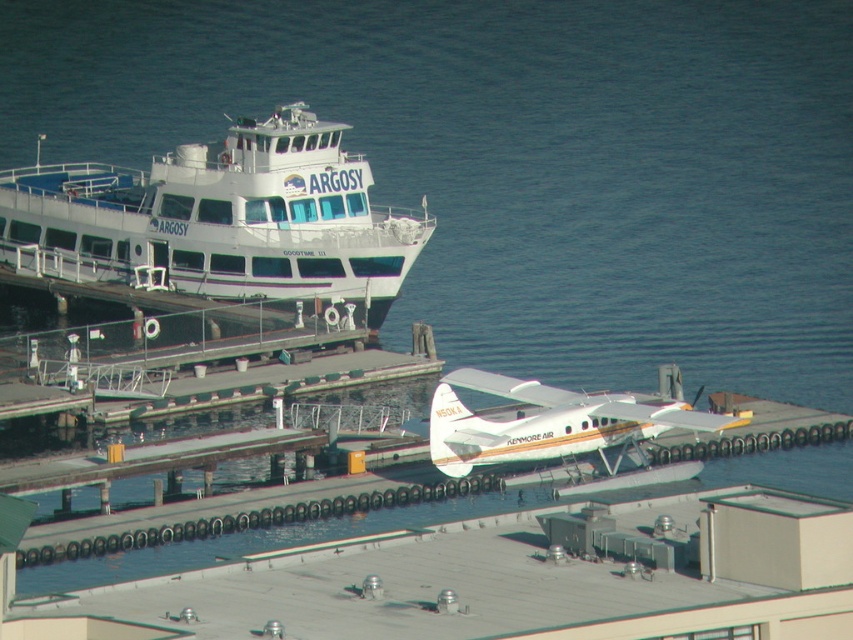
Looking at this image, is white glossy ferry boat at upper left below white matte seaplane at center?

Actually, white glossy ferry boat at upper left is above white matte seaplane at center.

The image size is (853, 640). In order to click on white glossy ferry boat at upper left in this screenshot , I will do `click(219, 220)`.

In order to click on white glossy ferry boat at upper left in this screenshot , I will do `click(219, 220)`.